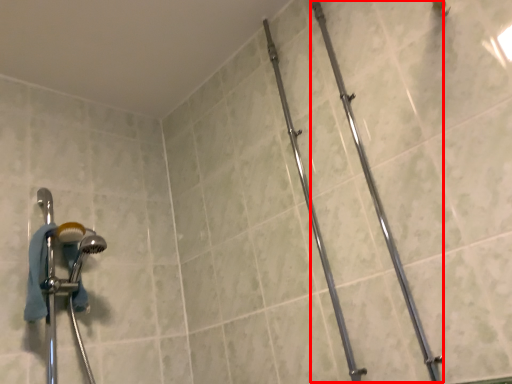
Question: Observing the image, what is the correct spatial positioning of pipe (annotated by the red box) in reference to pipe?

Choices:
 (A) left
 (B) right

Answer: (B)